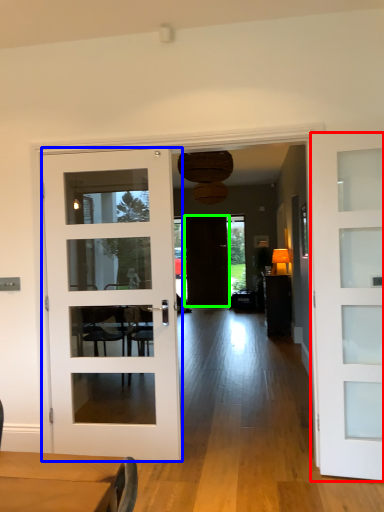
Question: Which is nearer to the door (highlighted by a red box)? door (highlighted by a blue box) or door (highlighted by a green box).

Choices:
 (A) door
 (B) door

Answer: (A)